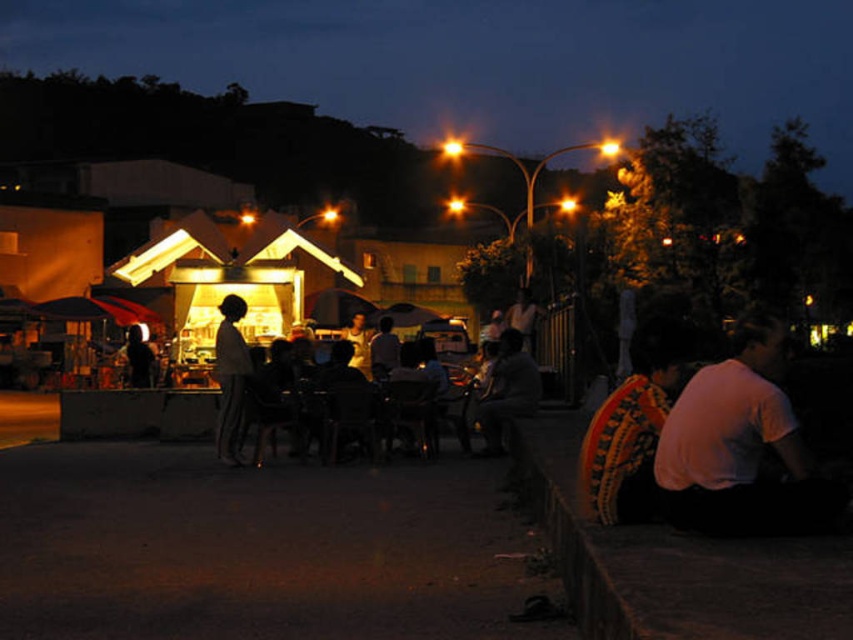
Is white matte shirt at lower right further to the viewer compared to silhouette fabric at center?

No, it is in front of silhouette fabric at center.

Who is more distant from viewer, (825, 516) or (218, 328)?

Positioned behind is point (218, 328).

Identify the location of white matte shirt at lower right. Image resolution: width=853 pixels, height=640 pixels. (737, 445).